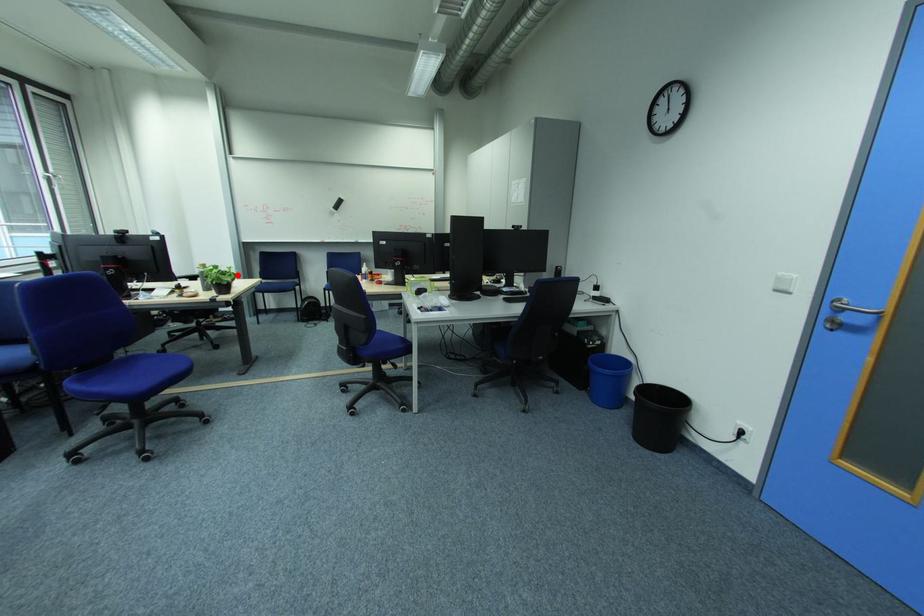
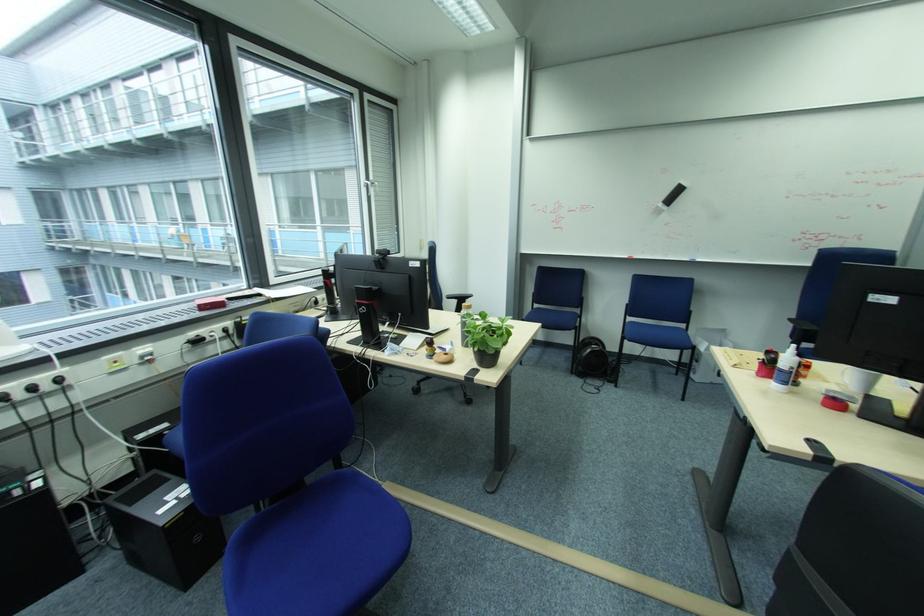
Question: I am providing you with two images of the same scene from different viewpoints. In image1, a red point is highlighted. Considering the same 3D point in image2, which of the following is correct?

Choices:
 (A) It is closer
 (B) It is farther

Answer: (B)